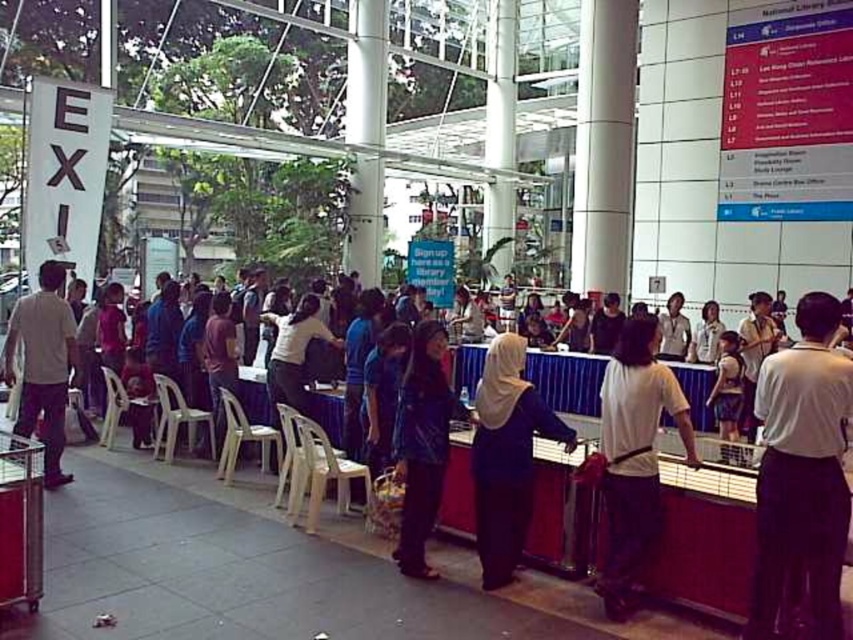
Question: Which of the following is the farthest from the observer?

Choices:
 (A) (624, 435)
 (B) (498, 353)
 (C) (436, 465)
 (D) (778, 579)

Answer: (C)

Question: Does purple matte hijab at center have a greater width compared to white matte shirt at left?

Choices:
 (A) no
 (B) yes

Answer: (A)

Question: Which of the following is the closest to the observer?

Choices:
 (A) (405, 481)
 (B) (476, 412)
 (C) (50, 419)
 (D) (654, 515)

Answer: (D)

Question: Where is white matte shirt at center located in relation to white matte shirt at left in the image?

Choices:
 (A) below
 (B) above

Answer: (A)

Question: Where is white matte shirt at center located in relation to dark blue leather jacket at center in the image?

Choices:
 (A) below
 (B) above

Answer: (A)

Question: Which object appears closest to the camera in this image?

Choices:
 (A) purple matte hijab at center
 (B) white matte shirt at center
 (C) white cotton shirt at center

Answer: (C)